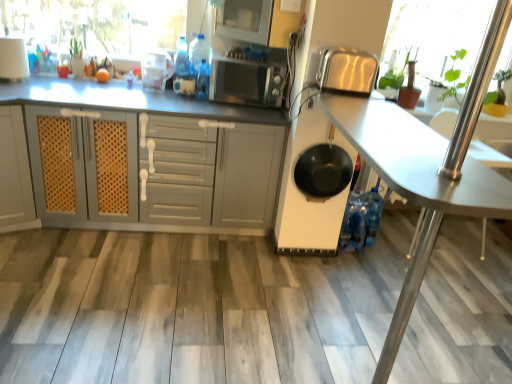
What do you see at coordinates (415, 187) in the screenshot? This screenshot has height=384, width=512. I see `metallic silver table at center` at bounding box center [415, 187].

The height and width of the screenshot is (384, 512). I want to click on transparent glass window screen at upper left, which appears as the 2th window screen when viewed from the right, so click(x=97, y=23).

What do you see at coordinates (13, 59) in the screenshot?
I see `white glossy lampshade at upper left, the third appliance positioned from the right` at bounding box center [13, 59].

What is the approximate width of black matte frying pan at center?

black matte frying pan at center is 15.65 centimeters wide.

At what (x,y) coordinates should I click in order to perform the action: click on black matte frying pan at center. Please return your answer as a coordinate pair (x, y). The image size is (512, 384). Looking at the image, I should click on (323, 171).

Describe the element at coordinates (131, 101) in the screenshot. Image resolution: width=512 pixels, height=384 pixels. I see `white matte cabinet at center` at that location.

Locate an element on the screen. The width and height of the screenshot is (512, 384). satin silver microwave at center is located at coordinates (247, 82).

Between green leafy plant at upper right, the second window screen viewed from the left, and satin silver toaster at upper right, which is the first appliance from front to back, which one has larger width?

Wider between the two is satin silver toaster at upper right, which is the first appliance from front to back.

Considering the sizes of objects green leafy plant at upper right, the second window screen viewed from the left, and satin silver toaster at upper right, acting as the 3th appliance starting from the left, in the image provided, who is taller, green leafy plant at upper right, the second window screen viewed from the left, or satin silver toaster at upper right, acting as the 3th appliance starting from the left,?

green leafy plant at upper right, the second window screen viewed from the left, is taller.

From the image's perspective, does green leafy plant at upper right, positioned as the 1th window screen in right-to-left order, appear lower than satin silver toaster at upper right, which ranks as the 3th appliance in back-to-front order?

No, from the image's perspective, green leafy plant at upper right, positioned as the 1th window screen in right-to-left order, is not below satin silver toaster at upper right, which ranks as the 3th appliance in back-to-front order.

Between green leafy plant at upper right, positioned as the 1th window screen in right-to-left order, and satin silver toaster at upper right, acting as the 3th appliance starting from the left, which one appears on the left side from the viewer's perspective?

satin silver toaster at upper right, acting as the 3th appliance starting from the left, is more to the left.

Which is in front, point (20, 43) or point (330, 76)?

The point (330, 76) is closer.

Between white glossy lampshade at upper left, marked as the 2th appliance in a back-to-front arrangement, and satin silver toaster at upper right, which ranks as the 3th appliance in back-to-front order, which one appears on the right side from the viewer's perspective?

Positioned to the right is satin silver toaster at upper right, which ranks as the 3th appliance in back-to-front order.

Identify the location of the 2nd appliance to the left of the satin silver toaster at upper right, which ranks as the 3th appliance in back-to-front order, starting your count from the anchor. (13, 59).

How much distance is there between white glossy lampshade at upper left, the third appliance positioned from the right, and satin silver toaster at upper right, which ranks as the 3th appliance in back-to-front order?

They are 6.02 feet apart.

From their relative heights in the image, would you say green leafy plant at upper right, positioned as the 1th window screen in right-to-left order, is taller or shorter than white matte cabinet at center?

Clearly, green leafy plant at upper right, positioned as the 1th window screen in right-to-left order, is shorter compared to white matte cabinet at center.

Is white matte cabinet at center a part of green leafy plant at upper right, positioned as the 1th window screen in right-to-left order?

Definitely not — white matte cabinet at center is not inside green leafy plant at upper right, positioned as the 1th window screen in right-to-left order.

In terms of size, does green leafy plant at upper right, positioned as the 1th window screen in right-to-left order, appear bigger or smaller than white matte cabinet at center?

In the image, green leafy plant at upper right, positioned as the 1th window screen in right-to-left order, appears to be smaller than white matte cabinet at center.

Considering the points (503, 33) and (414, 271), which point is in front, point (503, 33) or point (414, 271)?

Point (414, 271)

Measure the distance between transparent glass door at right and metallic silver table at center.

transparent glass door at right is 29.96 centimeters from metallic silver table at center.

At what (x,y) coordinates should I click in order to perform the action: click on glass door located above the metallic silver table at center (from the image's perspective). Please return your answer as a coordinate pair (x, y). The width and height of the screenshot is (512, 384). Looking at the image, I should click on pos(476,91).

Considering the sizes of transparent glass door at right and metallic silver table at center in the image, is transparent glass door at right wider or thinner than metallic silver table at center?

Considering their sizes, transparent glass door at right looks broader than metallic silver table at center.

Between transparent plastic container at upper center, the 3th appliance when ordered from front to back, and black matte frying pan at center, which one has less height?

Standing shorter between the two is transparent plastic container at upper center, the 3th appliance when ordered from front to back.

Is transparent plastic container at upper center, the second appliance positioned from the left, turned away from black matte frying pan at center?

No, transparent plastic container at upper center, the second appliance positioned from the left,'s orientation is not away from black matte frying pan at center.

From a real-world perspective, is transparent plastic container at upper center, the second appliance positioned from the left, beneath black matte frying pan at center?

No, from a real-world perspective, transparent plastic container at upper center, the second appliance positioned from the left, is not below black matte frying pan at center.

Based on the photo, is transparent plastic container at upper center, which is the second appliance from right to left, inside the boundaries of black matte frying pan at center, or outside?

transparent plastic container at upper center, which is the second appliance from right to left, lies outside black matte frying pan at center.

Between black matte frying pan at center and white matte cabinet at center, which one has smaller size?

black matte frying pan at center is smaller.

Based on the photo, considering the positions of objects black matte frying pan at center and white matte cabinet at center in the image provided, who is more to the right, black matte frying pan at center or white matte cabinet at center?

Positioned to the right is black matte frying pan at center.

Is white matte cabinet at center completely or partially inside black matte frying pan at center?

Definitely not — white matte cabinet at center is not inside black matte frying pan at center.

You are a GUI agent. You are given a task and a screenshot of the screen. Output one action in this format:
    pyautogui.click(x=<x>, y=<y>)
    Task: Click on the 1st appliance counting from the left of the transparent glass door at right
    The width and height of the screenshot is (512, 384).
    Given the screenshot: What is the action you would take?
    pyautogui.click(x=347, y=71)

Which is behind, point (488, 80) or point (375, 60)?

Positioned behind is point (375, 60).

How different are the orientations of transparent glass door at right and satin silver toaster at upper right, acting as the 3th appliance starting from the left, in degrees?

1.03 degrees.

Can you confirm if transparent glass door at right is wider than satin silver toaster at upper right, which ranks as the 3th appliance in back-to-front order?

Correct, the width of transparent glass door at right exceeds that of satin silver toaster at upper right, which ranks as the 3th appliance in back-to-front order.

At what (x,y) coordinates should I click in order to perform the action: click on window screen on the right of satin silver toaster at upper right, acting as the 3th appliance starting from the left. Please return your answer as a coordinate pair (x, y). This screenshot has width=512, height=384. Looking at the image, I should click on (435, 34).

This screenshot has width=512, height=384. What are the coordinates of `appliance that appears in front of the white glossy lampshade at upper left, the third appliance positioned from the right` in the screenshot? It's located at (347, 71).

From the image, which object appears to be farther from black matte frying pan at center, white matte cabinet at center or white glossy lampshade at upper left, marked as the 2th appliance in a back-to-front arrangement?

white glossy lampshade at upper left, marked as the 2th appliance in a back-to-front arrangement.

Based on their spatial positions, is satin silver toaster at upper right, which is the first appliance from front to back, or metallic silver table at center further from transparent glass door at right?

Based on the image, satin silver toaster at upper right, which is the first appliance from front to back, appears to be further to transparent glass door at right.

Which object lies nearer to the anchor point green leafy plant at upper right, positioned as the 1th window screen in right-to-left order, satin silver toaster at upper right, which is the 1th appliance in right-to-left order, or satin silver microwave at center?

satin silver toaster at upper right, which is the 1th appliance in right-to-left order.

From the image, which object appears to be farther from satin silver toaster at upper right, which ranks as the 3th appliance in back-to-front order, transparent glass door at right or green leafy plant at upper right, the second window screen viewed from the left?

green leafy plant at upper right, the second window screen viewed from the left, lies further to satin silver toaster at upper right, which ranks as the 3th appliance in back-to-front order, than the other object.

Estimate the real-world distances between objects in this image. Which object is closer to transparent glass window screen at upper left, which appears as the 2th window screen when viewed from the right, green leafy plant at upper right, positioned as the 1th window screen in right-to-left order, or metallic silver table at center?

Based on the image, metallic silver table at center appears to be nearer to transparent glass window screen at upper left, which appears as the 2th window screen when viewed from the right.

When comparing their distances from transparent plastic container at upper center, which is the 1th appliance in back-to-front order, does black matte frying pan at center or transparent glass window screen at upper left, which appears as the 2th window screen when viewed from the right, seem further?

black matte frying pan at center is positioned further to the anchor transparent plastic container at upper center, which is the 1th appliance in back-to-front order.

Based on their spatial positions, is satin silver microwave at center or white matte cabinet at center further from white glossy lampshade at upper left, marked as the 2th appliance in a back-to-front arrangement?

The object further to white glossy lampshade at upper left, marked as the 2th appliance in a back-to-front arrangement, is satin silver microwave at center.

From the image, which object appears to be farther from white glossy lampshade at upper left, positioned as the 2th appliance in front-to-back order, satin silver microwave at center or green leafy plant at upper right, positioned as the 1th window screen in right-to-left order?

green leafy plant at upper right, positioned as the 1th window screen in right-to-left order, lies further to white glossy lampshade at upper left, positioned as the 2th appliance in front-to-back order, than the other object.

Find the location of a particular element. cabinetry located between transparent glass window screen at upper left, the first window screen positioned from the left, and black matte frying pan at center in the left-right direction is located at coordinates (131, 101).

Identify the location of table between white matte cabinet at center and green leafy plant at upper right, the second window screen viewed from the left, in the horizontal direction. (415, 187).

At what (x,y) coordinates should I click in order to perform the action: click on frying pan located between white matte cabinet at center and satin silver toaster at upper right, acting as the 3th appliance starting from the left, in the left-right direction. Please return your answer as a coordinate pair (x, y). Looking at the image, I should click on (323, 171).

Find the location of `cabinetry between white glossy lampshade at upper left, marked as the 2th appliance in a back-to-front arrangement, and satin silver toaster at upper right, which is the first appliance from front to back`. cabinetry between white glossy lampshade at upper left, marked as the 2th appliance in a back-to-front arrangement, and satin silver toaster at upper right, which is the first appliance from front to back is located at coordinates point(131,101).